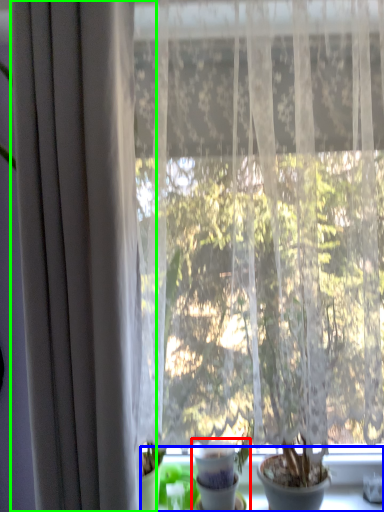
Question: Which object is positioned closest to houseplant (highlighted by a red box)? Select from window sill (highlighted by a blue box) and curtain (highlighted by a green box).

Choices:
 (A) window sill
 (B) curtain

Answer: (A)